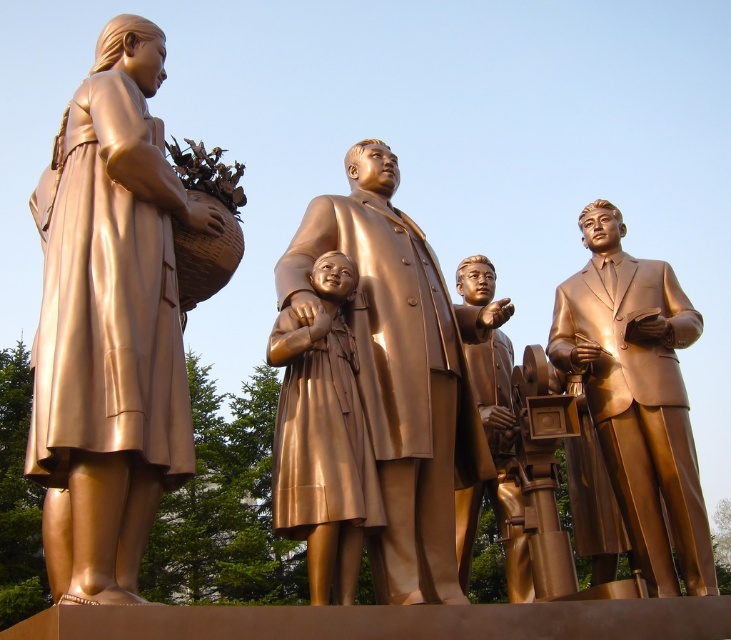
Question: Which point is closer to the camera taking this photo?

Choices:
 (A) (471, 490)
 (B) (306, 344)

Answer: (B)

Question: Is shiny gold statue at left closer to the viewer compared to shiny bronze statue at right?

Choices:
 (A) yes
 (B) no

Answer: (A)

Question: Which of the following is the farthest from the observer?

Choices:
 (A) tap(385, 337)
 (B) tap(162, 310)
 (C) tap(341, 577)
 (D) tap(605, 312)

Answer: (D)

Question: Which point is farther to the camera?

Choices:
 (A) (664, 433)
 (B) (338, 252)

Answer: (A)

Question: Is shiny gold statue at left to the left of bronze statue of child at center from the viewer's perspective?

Choices:
 (A) no
 (B) yes

Answer: (B)

Question: Is bronze statue at center positioned in front of shiny bronze statue at center?

Choices:
 (A) yes
 (B) no

Answer: (A)